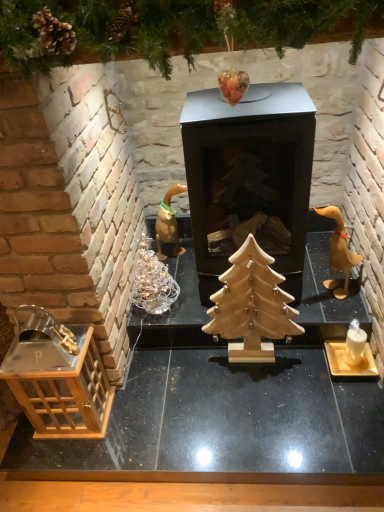
Question: Considering the relative sizes of wooden table at lower left and wooden christmas tree at upper center in the image provided, is wooden table at lower left bigger than wooden christmas tree at upper center?

Choices:
 (A) yes
 (B) no

Answer: (A)

Question: Considering the relative positions of wooden table at lower left and wooden christmas tree at upper center in the image provided, is wooden table at lower left to the left of wooden christmas tree at upper center from the viewer's perspective?

Choices:
 (A) yes
 (B) no

Answer: (B)

Question: Is wooden table at lower left positioned with its back to wooden christmas tree at upper center?

Choices:
 (A) no
 (B) yes

Answer: (A)

Question: From a real-world perspective, is wooden table at lower left over wooden christmas tree at upper center?

Choices:
 (A) yes
 (B) no

Answer: (B)

Question: Is wooden table at lower left positioned far away from wooden christmas tree at upper center?

Choices:
 (A) no
 (B) yes

Answer: (B)

Question: Can you confirm if wooden table at lower left is positioned to the right of wooden christmas tree at upper center?

Choices:
 (A) yes
 (B) no

Answer: (A)

Question: Is transparent glass lantern at lower left a part of wooden duckling at right?

Choices:
 (A) no
 (B) yes

Answer: (A)

Question: Is wooden duckling at right oriented towards transparent glass lantern at lower left?

Choices:
 (A) yes
 (B) no

Answer: (B)

Question: From a real-world perspective, is wooden duckling at right under transparent glass lantern at lower left?

Choices:
 (A) yes
 (B) no

Answer: (B)

Question: Is wooden duckling at right at the left side of transparent glass lantern at lower left?

Choices:
 (A) no
 (B) yes

Answer: (A)

Question: Can you confirm if wooden duckling at right is smaller than transparent glass lantern at lower left?

Choices:
 (A) yes
 (B) no

Answer: (A)

Question: Is wooden duckling at right not within transparent glass lantern at lower left?

Choices:
 (A) no
 (B) yes

Answer: (B)

Question: Does transparent glass lantern at lower left have a larger size compared to natural wood christmas tree at center?

Choices:
 (A) no
 (B) yes

Answer: (B)